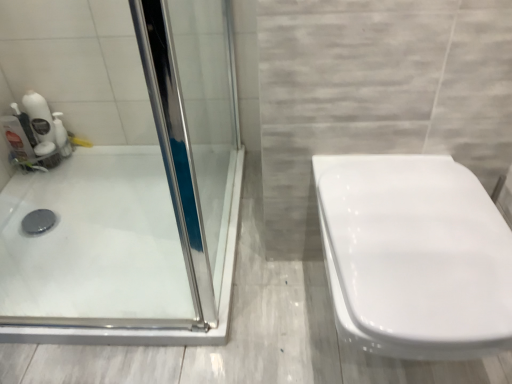
Identify the location of white glossy toilet at right. This screenshot has width=512, height=384. (414, 256).

What do you see at coordinates (414, 256) in the screenshot?
I see `white glossy toilet at right` at bounding box center [414, 256].

At what (x,y) coordinates should I click in order to perform the action: click on white glossy toilet at right. Please return your answer as a coordinate pair (x, y). The width and height of the screenshot is (512, 384). Looking at the image, I should click on (414, 256).